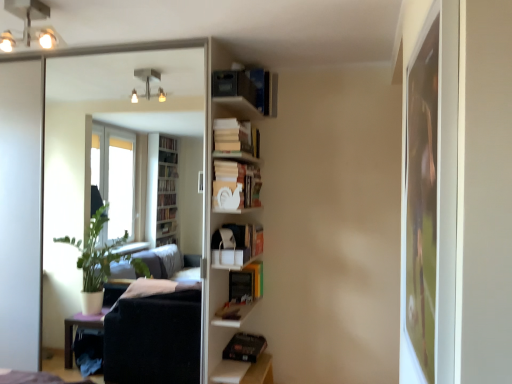
Question: Should I look upward or downward to see matte black bookshelf at upper center, which is the 1th book in top-to-bottom order?

Choices:
 (A) down
 (B) up

Answer: (B)

Question: Is white matte bookshelf at upper center, the second book when ordered from top to bottom, oriented towards black matte book at lower center, the fifth book from the top?

Choices:
 (A) yes
 (B) no

Answer: (B)

Question: Can you confirm if white matte bookshelf at upper center, the second book when ordered from top to bottom, is taller than black matte book at lower center, the fifth book from the top?

Choices:
 (A) yes
 (B) no

Answer: (A)

Question: Considering the relative sizes of white matte bookshelf at upper center, which appears as the 4th book when ordered from the bottom, and black matte book at lower center, the fifth book from the top, in the image provided, is white matte bookshelf at upper center, which appears as the 4th book when ordered from the bottom, thinner than black matte book at lower center, the fifth book from the top,?

Choices:
 (A) no
 (B) yes

Answer: (B)

Question: From the image's perspective, is white matte bookshelf at upper center, which appears as the 4th book when ordered from the bottom, located beneath black matte book at lower center, the fifth book from the top?

Choices:
 (A) no
 (B) yes

Answer: (A)

Question: Is white matte bookshelf at upper center, which appears as the 4th book when ordered from the bottom, to the right of black matte book at lower center, the fifth book from the top, from the viewer's perspective?

Choices:
 (A) yes
 (B) no

Answer: (B)

Question: From the image's perspective, is white matte bookshelf at upper center, the second book when ordered from top to bottom, above black matte book at lower center, which is the first book from bottom to top?

Choices:
 (A) no
 (B) yes

Answer: (B)

Question: Can you confirm if hardcover book at center, the fourth book when ordered from top to bottom, is positioned to the left of white glossy bookshelf at upper center?

Choices:
 (A) yes
 (B) no

Answer: (B)

Question: From the image's perspective, does hardcover book at center, placed as the 2th book when sorted from bottom to top, appear lower than white glossy bookshelf at upper center?

Choices:
 (A) no
 (B) yes

Answer: (B)

Question: Is hardcover book at center, placed as the 2th book when sorted from bottom to top, surrounding white glossy bookshelf at upper center?

Choices:
 (A) no
 (B) yes

Answer: (A)

Question: Can you confirm if hardcover book at center, the fourth book when ordered from top to bottom, is bigger than white glossy bookshelf at upper center?

Choices:
 (A) no
 (B) yes

Answer: (A)

Question: Is the depth of hardcover book at center, placed as the 2th book when sorted from bottom to top, less than that of white glossy bookshelf at upper center?

Choices:
 (A) yes
 (B) no

Answer: (B)

Question: Could you tell me if hardcover book at center, the fourth book when ordered from top to bottom, is turned towards white glossy bookshelf at upper center?

Choices:
 (A) yes
 (B) no

Answer: (B)

Question: From a real-world perspective, is white matte cat at center, which is the third book in top-to-bottom order, under white matte shelf at center?

Choices:
 (A) yes
 (B) no

Answer: (B)